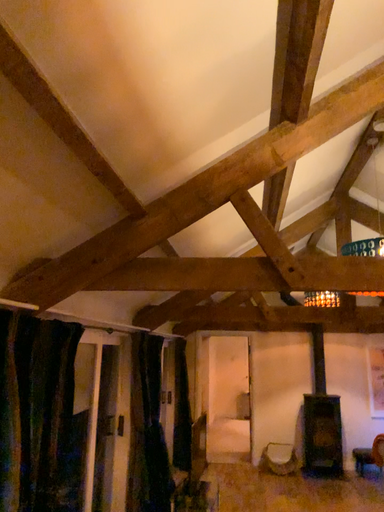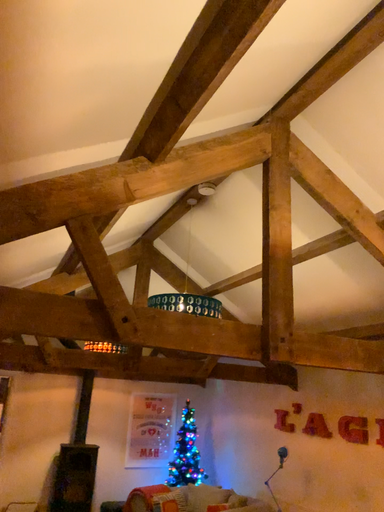
Question: Which way did the camera rotate in the video?

Choices:
 (A) rotated left
 (B) rotated right

Answer: (B)